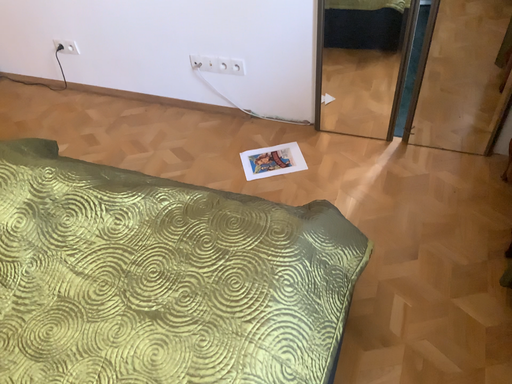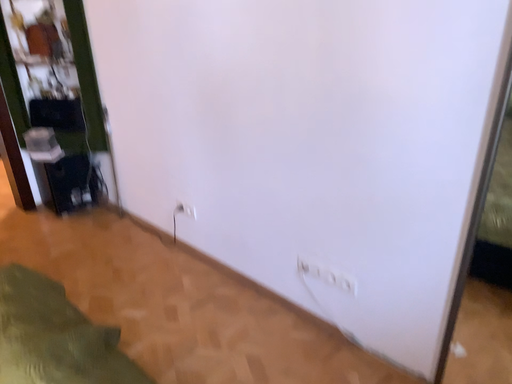
Question: How did the camera likely rotate when shooting the video?

Choices:
 (A) rotated right
 (B) rotated left

Answer: (B)